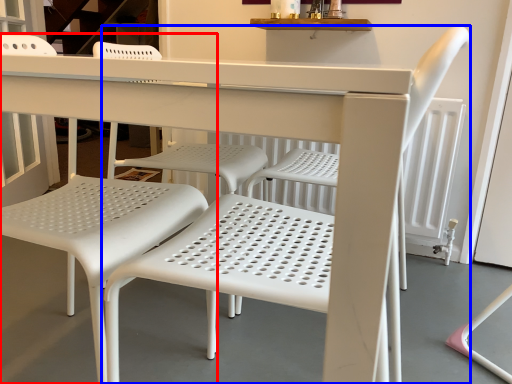
Question: Among these objects, which one is nearest to the camera, chair (highlighted by a red box) or chair (highlighted by a blue box)?

Choices:
 (A) chair
 (B) chair

Answer: (B)